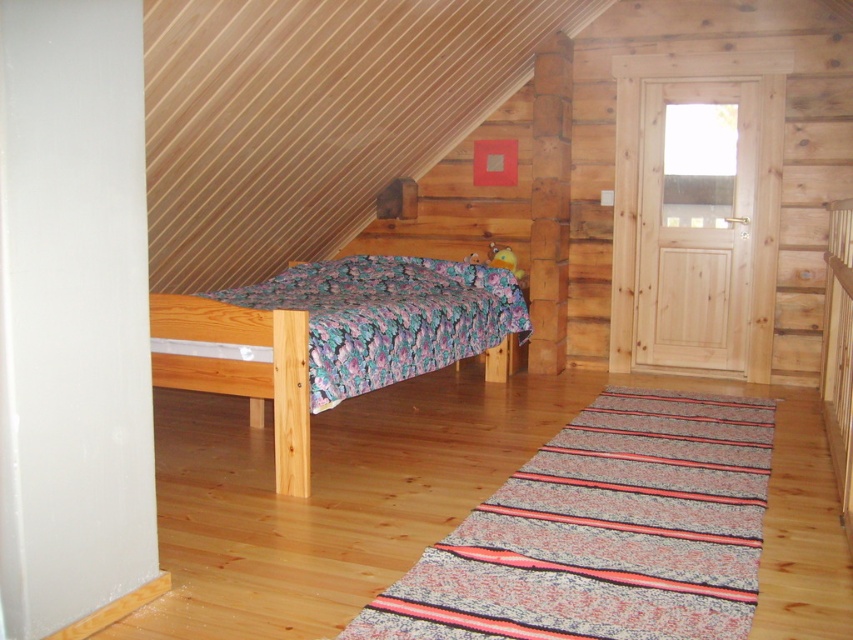
Between floral fabric quilt at center and wooden bed at center, which one appears on the right side from the viewer's perspective?

floral fabric quilt at center is more to the right.

This screenshot has height=640, width=853. Describe the element at coordinates (604, 532) in the screenshot. I see `floral fabric quilt at center` at that location.

Locate an element on the screen. floral fabric quilt at center is located at coordinates coord(604,532).